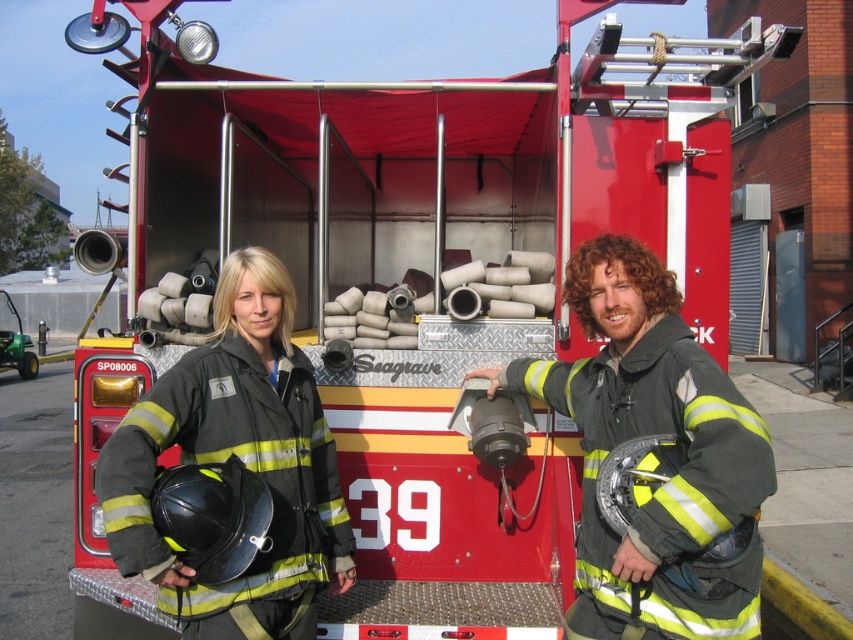
Consider the image. You are a photographer taking a group photo of the black matte uniform at right and the black matte uniform at left. Which firefighter should you position closer to the camera to ensure both appear the same height in the photo?

You should position the black matte uniform at left closer to the camera because the black matte uniform at right is taller than the black matte uniform at left. By moving the shorter firefighter forward, their apparent heights in the photo will be balanced.

You are a photographer trying to capture both firefighters in a clear photo. Since the black matte uniform at right and the black matte uniform at left are overlapping, which one is blocking the view of the other?

The black matte uniform at right is positioned over the black matte uniform at left, so the black matte uniform at right is blocking the view of the black matte uniform at left.